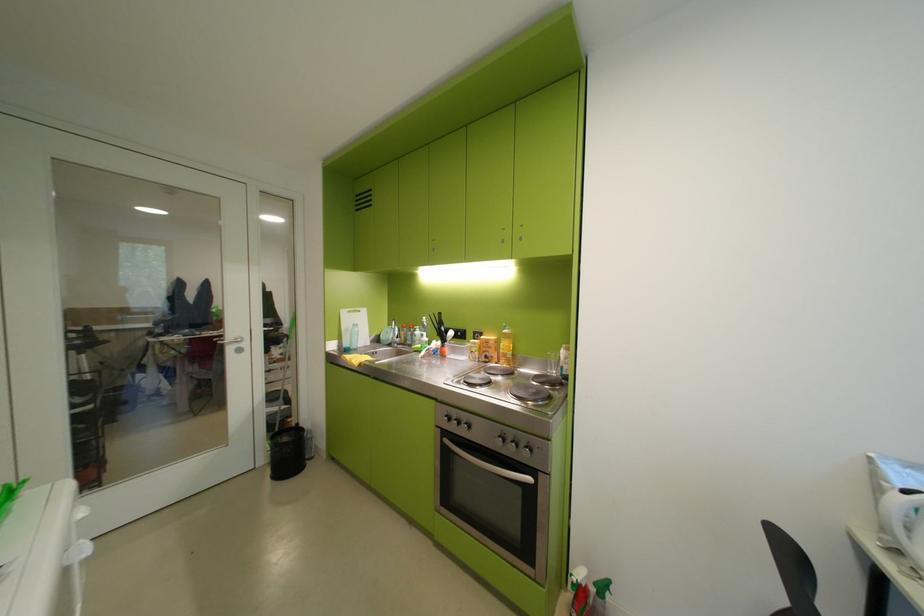
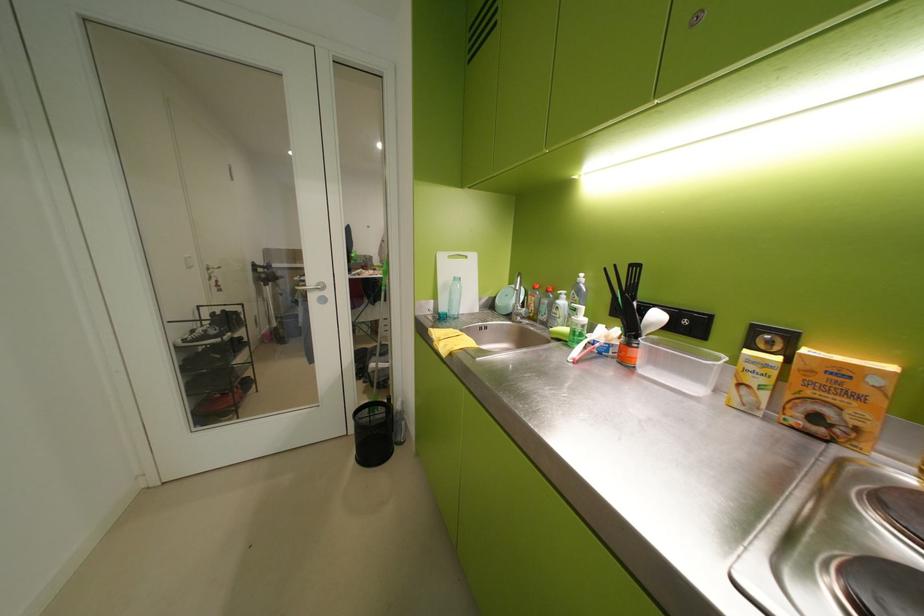
The point at (355,314) is marked in the first image. Where is the corresponding point in the second image?

(453, 259)